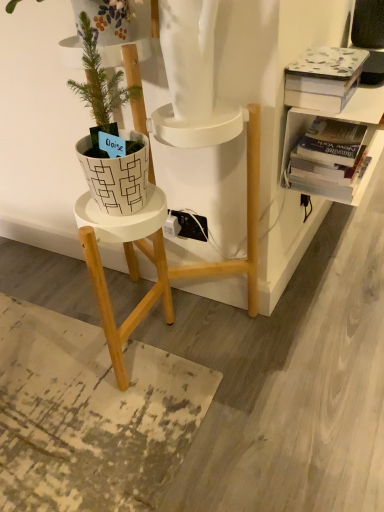
Where is `blank space situated above white textured book at upper right, the first book when ordered from top to bottom (from a real-world perspective)`? The width and height of the screenshot is (384, 512). blank space situated above white textured book at upper right, the first book when ordered from top to bottom (from a real-world perspective) is located at coordinates (325, 57).